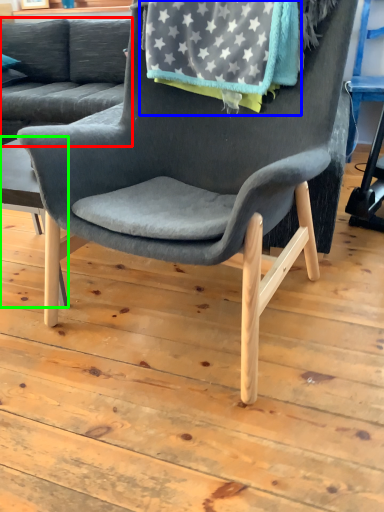
Question: Which object is the closest to the studio couch (highlighted by a red box)? Choose among these: blanket (highlighted by a blue box) or table (highlighted by a green box).

Choices:
 (A) blanket
 (B) table

Answer: (B)